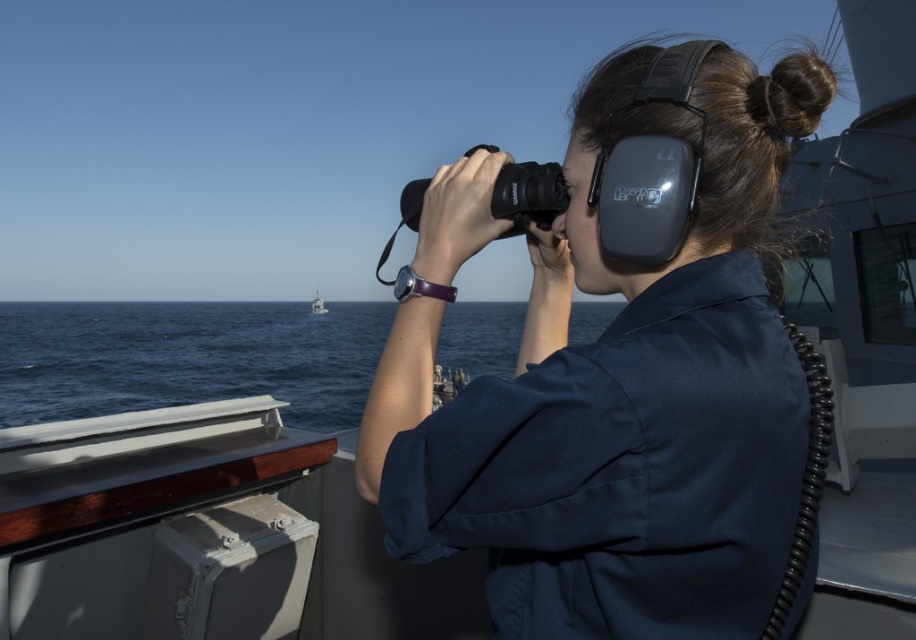
You are on a ship deck and need to locate the matte black binoculars at center and the blue water at lower left. Based on their positions, which object is closer to the right edge of the deck?

The matte black binoculars at center is positioned on the right side of blue water at lower left, so the matte black binoculars at center is closer to the right edge of the deck.